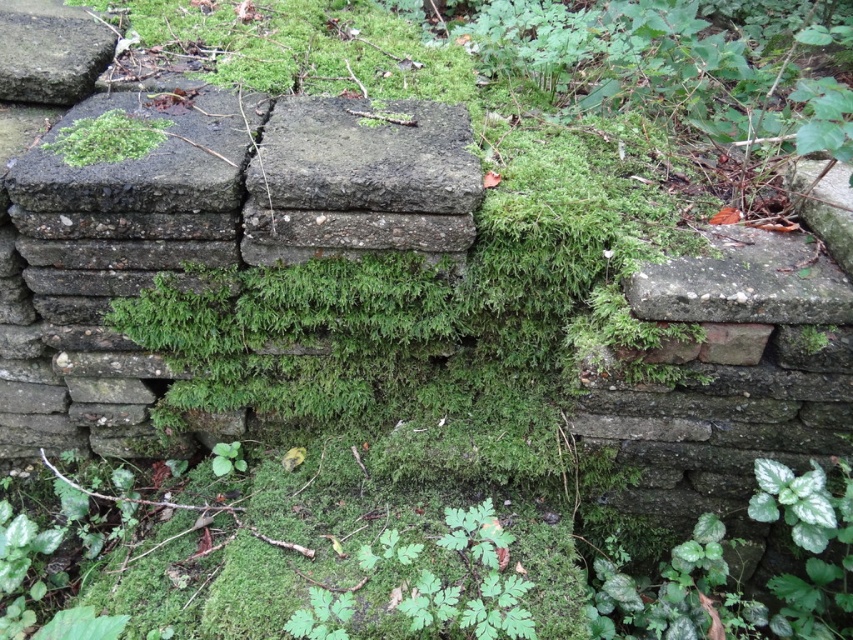
Question: Which point is closer to the camera?

Choices:
 (A) rough concrete block at center
 (B) green mossy patch at upper left

Answer: (A)

Question: Does smooth gray stone at upper left have a greater width compared to green mossy patch at upper left?

Choices:
 (A) yes
 (B) no

Answer: (A)

Question: Which of the following is the farthest from the observer?

Choices:
 (A) (x=131, y=147)
 (B) (x=434, y=173)

Answer: (A)

Question: Does smooth gray stone at upper left appear on the right side of green mossy patch at upper left?

Choices:
 (A) no
 (B) yes

Answer: (A)

Question: Can you confirm if rough concrete block at center is positioned below smooth gray stone at upper left?

Choices:
 (A) no
 (B) yes

Answer: (B)

Question: Among these objects, which one is nearest to the camera?

Choices:
 (A) green mossy patch at upper left
 (B) rough concrete block at center

Answer: (B)